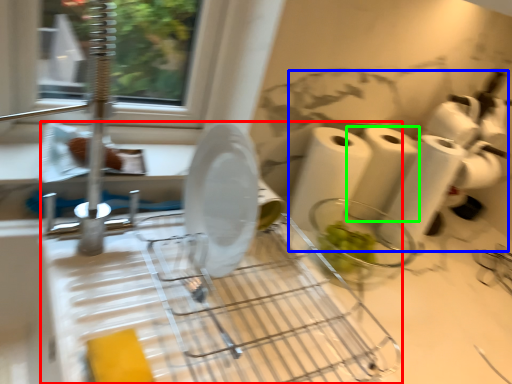
Question: Which is farther away from appliance (highlighted by a red box)? toilet paper (highlighted by a blue box) or paper towel (highlighted by a green box)?

Choices:
 (A) toilet paper
 (B) paper towel

Answer: (A)